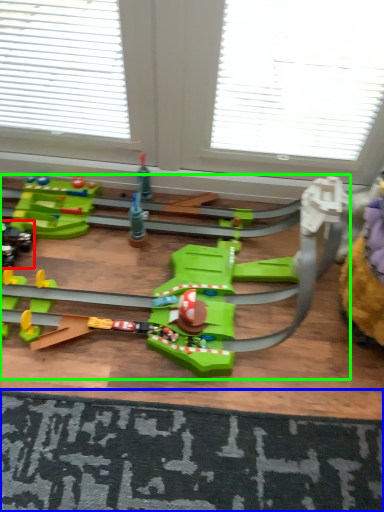
Question: Which object is the farthest from toy (highlighted by a red box)? Choose among these: doormat (highlighted by a blue box) or toy (highlighted by a green box).

Choices:
 (A) doormat
 (B) toy

Answer: (A)